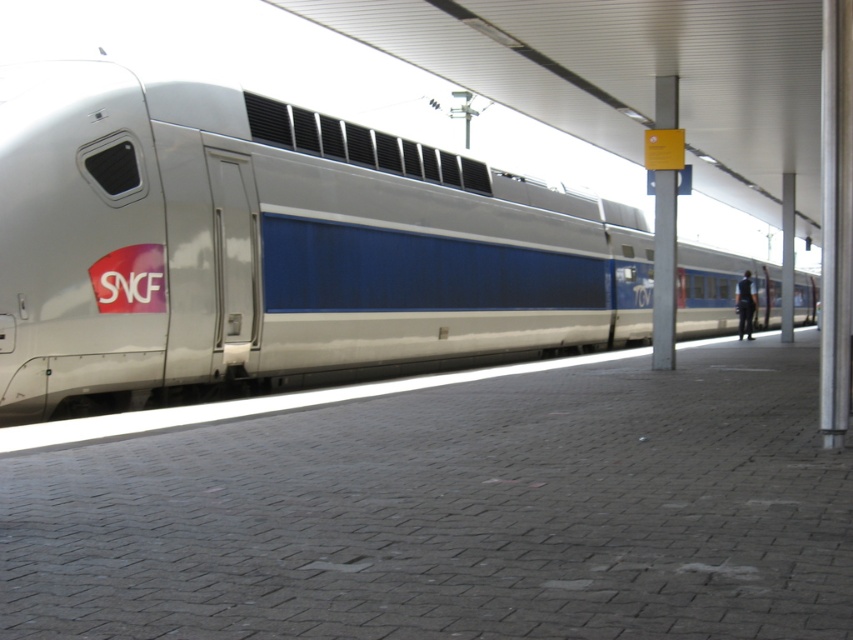
You are standing on the platform and want to take a photo of the white glossy train at center without anyone blocking the view. Is there a risk that the black fabric person at right might be in the way?

The white glossy train at center might be wider than the black fabric person at right, so there is a possibility that the person could be in the frame depending on your position. To ensure a clear shot, move to a position where the person is out of the camera angle.

You are a passenger waiting on the platform and see the white glossy train at center and the black fabric person at right. Which object is nearer to you?

The white glossy train at center is closer to the viewer than the black fabric person at right.